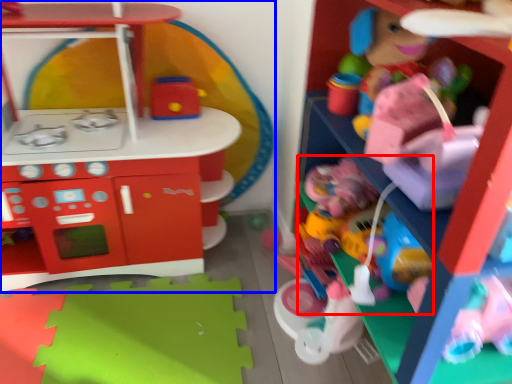
Question: Which object appears farthest to the camera in this image, toy (highlighted by a red box) or toy (highlighted by a blue box)?

Choices:
 (A) toy
 (B) toy

Answer: (A)